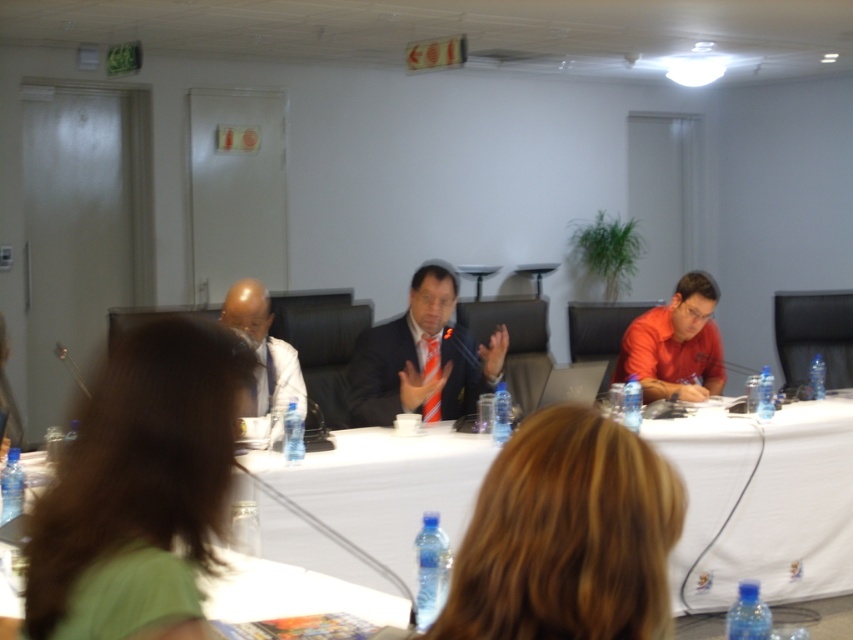
Who is taller, green matte shirt at center or blonde hair at center?

Standing taller between the two is green matte shirt at center.

This screenshot has width=853, height=640. I want to click on green matte shirt at center, so [138, 484].

In order to click on green matte shirt at center in this screenshot , I will do `click(138, 484)`.

Who is higher up, orange matte shirt at right or matte white shirt at left?

orange matte shirt at right

Which of these two, orange matte shirt at right or matte white shirt at left, stands taller?

Standing taller between the two is orange matte shirt at right.

What are the coordinates of `orange matte shirt at right` in the screenshot? It's located at (676, 344).

Identify the location of blonde hair at center. (567, 536).

Which is behind, point (456, 589) or point (454, 346)?

The point (454, 346) is behind.

Who is more forward, (502,452) or (407,320)?

Point (502,452) is more forward.

Locate an element on the screen. The image size is (853, 640). blonde hair at center is located at coordinates (567, 536).